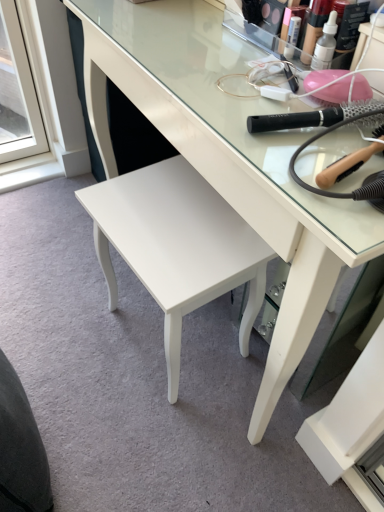
Where is `unoccupied space behind black plastic hairbrush at upper right, which is counted as the first brush, starting from the top`? unoccupied space behind black plastic hairbrush at upper right, which is counted as the first brush, starting from the top is located at coordinates (257, 79).